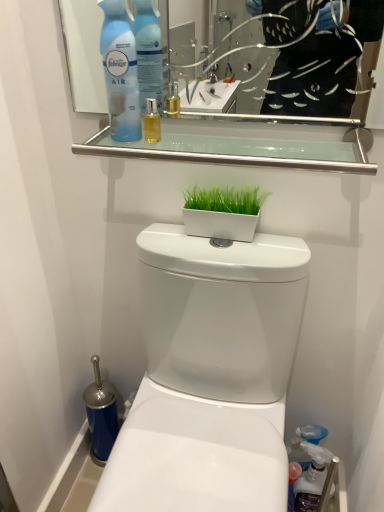
Identify the location of vacant area that is in front of white glossy flowerpot at center. This screenshot has height=512, width=384. (235, 255).